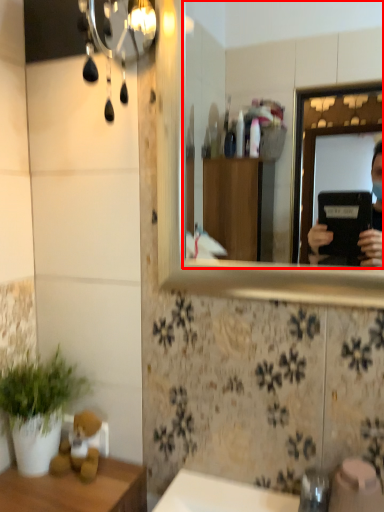
Question: From the image's perspective, where is mirror (annotated by the red box) located in relation to houseplant in the image?

Choices:
 (A) above
 (B) below

Answer: (A)